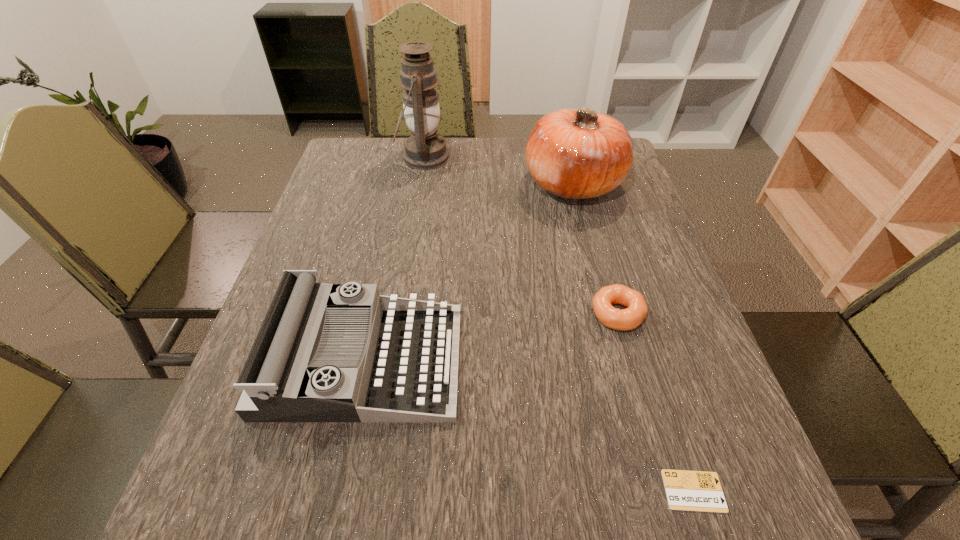
Locate an element on the screen. The height and width of the screenshot is (540, 960). free space between the shortest object and the typewriter is located at coordinates (529, 426).

Locate an element on the screen. free space that is in between the shortest object and the oil lamp is located at coordinates (559, 324).

Where is `free space between the second tallest object and the fourth tallest object`? free space between the second tallest object and the fourth tallest object is located at coordinates (595, 249).

I want to click on free space between the third tallest object and the identity card, so click(x=529, y=426).

Locate an element on the screen. Image resolution: width=960 pixels, height=540 pixels. the third closest object to the identity card is located at coordinates (579, 153).

Locate which object ranks fourth in proximity to the second shortest object. Please provide its 2D coordinates. Your answer should be formatted as a tuple, i.e. [(x, y)], where the tuple contains the x and y coordinates of a point satisfying the conditions above.

[(425, 149)]

The image size is (960, 540). I want to click on vacant region that satisfies the following two spatial constraints: 1. on the front side of the second tallest object; 2. on the right side of the nearest object, so click(x=651, y=491).

The height and width of the screenshot is (540, 960). Identify the location of free space that satisfies the following two spatial constraints: 1. on the front side of the identity card; 2. on the right side of the doughnut. (666, 491).